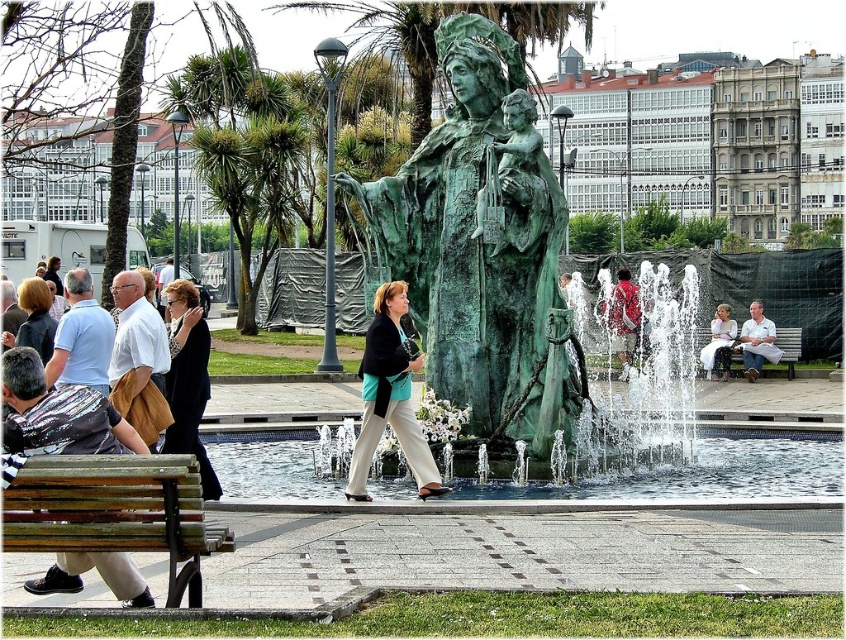
Question: Which is farther from the wooden bench at center?

Choices:
 (A) wooden bench at lower left
 (B) green patina fountain at center

Answer: (A)

Question: Among these points, which one is farthest from the camera?

Choices:
 (A) (163, 376)
 (B) (757, 336)
 (C) (717, 340)

Answer: (C)

Question: Can you confirm if matte black jacket at center is positioned to the left of red fabric shirt at center?

Choices:
 (A) yes
 (B) no

Answer: (A)

Question: Is matte black jacket at left closer to the viewer compared to white cotton shirt at center?

Choices:
 (A) yes
 (B) no

Answer: (A)

Question: Which of these objects is positioned closest to the black fabric coat at left?

Choices:
 (A) wooden bench at center
 (B) white cotton shirt at center
 (C) green patina statue at center

Answer: (C)

Question: Can you confirm if red fabric shirt at center is smaller than wooden bench at center?

Choices:
 (A) yes
 (B) no

Answer: (B)